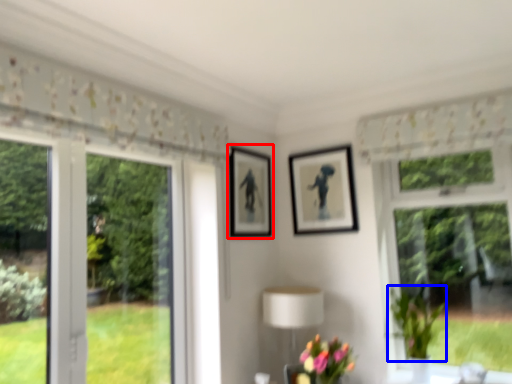
Question: Among these objects, which one is farthest to the camera, picture frame (highlighted by a red box) or plant (highlighted by a blue box)?

Choices:
 (A) picture frame
 (B) plant

Answer: (A)